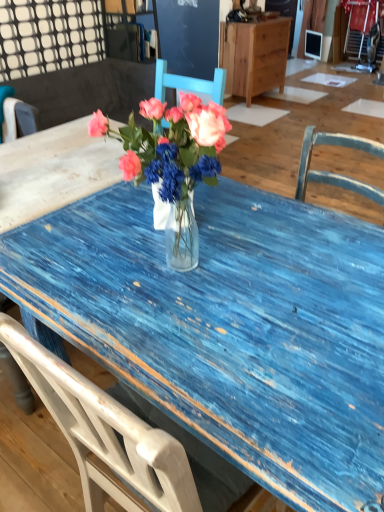
What do you see at coordinates (175, 146) in the screenshot?
I see `matte glass vase at center` at bounding box center [175, 146].

The height and width of the screenshot is (512, 384). I want to click on wooden cabinet at upper center, so click(254, 56).

This screenshot has height=512, width=384. Find the location of `white wood chair at left, which is the 2th chair from right to left`. white wood chair at left, which is the 2th chair from right to left is located at coordinates (18, 119).

This screenshot has width=384, height=512. Identify the location of matte glass vase at center. (175, 146).

Find the location of a particular element. The width and height of the screenshot is (384, 512). chair that is the 2nd one below the matte glass vase at center (from a real-world perspective) is located at coordinates (88, 91).

How different are the orientations of matte glass vase at center and blue wooden chair at upper left, acting as the first chair starting from the right, in degrees?

They differ by 131 degrees in their facing directions.

From the image's perspective, is matte glass vase at center beneath blue wooden chair at upper left, which is the second chair in left-to-right order?

Yes, from the image's perspective, matte glass vase at center is beneath blue wooden chair at upper left, which is the second chair in left-to-right order.

Consider the image. Between matte glass vase at center and blue wooden chair at upper left, acting as the first chair starting from the right, which one has more height?

blue wooden chair at upper left, acting as the first chair starting from the right, is taller.

Is wooden cabinet at upper center bigger than matte glass vase at center?

Correct, wooden cabinet at upper center is larger in size than matte glass vase at center.

What's the angular difference between wooden cabinet at upper center and matte glass vase at center's facing directions?

There is a 130-degree angle between the facing directions of wooden cabinet at upper center and matte glass vase at center.

From the image's perspective, which is above, wooden cabinet at upper center or matte glass vase at center?

From the image's view, wooden cabinet at upper center is above.

Which object is closer to the camera taking this photo, wooden cabinet at upper center or matte glass vase at center?

Positioned in front is matte glass vase at center.

Consider the image. Is white wood chair at left, which is the 2th chair from right to left, far away from matte glass vase at center?

white wood chair at left, which is the 2th chair from right to left, is far away from matte glass vase at center.

Is white wood chair at left, placed as the 1th chair when sorted from left to right, thinner than matte glass vase at center?

Indeed, white wood chair at left, placed as the 1th chair when sorted from left to right, has a lesser width compared to matte glass vase at center.

Between white wood chair at left, placed as the 1th chair when sorted from left to right, and matte glass vase at center, which one is positioned in front?

Positioned in front is matte glass vase at center.

In terms of height, does white wood chair at left, which is the 2th chair from right to left, look taller or shorter compared to matte glass vase at center?

Clearly, white wood chair at left, which is the 2th chair from right to left, is taller compared to matte glass vase at center.

Which is in front, blue wooden chair at upper left, which is the second chair in left-to-right order, or wooden cabinet at upper center?

blue wooden chair at upper left, which is the second chair in left-to-right order, is closer to the camera.

Based on the photo, how different are the orientations of blue wooden chair at upper left, acting as the first chair starting from the right, and wooden cabinet at upper center in degrees?

0.166 degrees separate the facing orientations of blue wooden chair at upper left, acting as the first chair starting from the right, and wooden cabinet at upper center.

Does blue wooden chair at upper left, acting as the first chair starting from the right, have a greater height compared to wooden cabinet at upper center?

No, blue wooden chair at upper left, acting as the first chair starting from the right, is not taller than wooden cabinet at upper center.

Is blue wooden chair at upper left, acting as the first chair starting from the right, positioned far away from wooden cabinet at upper center?

That's right, there is a large distance between blue wooden chair at upper left, acting as the first chair starting from the right, and wooden cabinet at upper center.

Can you confirm if matte glass vase at center is taller than white wood chair at left, placed as the 1th chair when sorted from left to right?

No.

From the picture: Is matte glass vase at center not near white wood chair at left, placed as the 1th chair when sorted from left to right?

That's right, there is a large distance between matte glass vase at center and white wood chair at left, placed as the 1th chair when sorted from left to right.

Does point (172, 167) come in front of point (30, 126)?

Yes, point (172, 167) is closer to viewer.

How different are the orientations of matte glass vase at center and white wood chair at left, which is the 2th chair from right to left, in degrees?

There is a 139-degree angle between the facing directions of matte glass vase at center and white wood chair at left, which is the 2th chair from right to left.

Where is `chair on the left of blue wooden chair at upper left, which is the second chair in left-to-right order`? This screenshot has width=384, height=512. chair on the left of blue wooden chair at upper left, which is the second chair in left-to-right order is located at coordinates (18, 119).

Does white wood chair at left, which is the 2th chair from right to left, have a larger size compared to blue wooden chair at upper left, acting as the first chair starting from the right?

No.

From the picture: Which object is positioned more to the right, white wood chair at left, which is the 2th chair from right to left, or blue wooden chair at upper left, acting as the first chair starting from the right?

blue wooden chair at upper left, acting as the first chair starting from the right, is more to the right.

What's the angular difference between white wood chair at left, placed as the 1th chair when sorted from left to right, and blue wooden chair at upper left, acting as the first chair starting from the right,'s facing directions?

white wood chair at left, placed as the 1th chair when sorted from left to right, and blue wooden chair at upper left, acting as the first chair starting from the right, are facing 90.5 degrees away from each other.

Is blue wooden chair at upper left, acting as the first chair starting from the right, oriented away from white wood chair at left, placed as the 1th chair when sorted from left to right?

No.

Does blue wooden chair at upper left, acting as the first chair starting from the right, come in front of white wood chair at left, placed as the 1th chair when sorted from left to right?

Yes, blue wooden chair at upper left, acting as the first chair starting from the right, is closer to the viewer.

From a real-world perspective, between blue wooden chair at upper left, acting as the first chair starting from the right, and white wood chair at left, placed as the 1th chair when sorted from left to right, who is vertically higher?

white wood chair at left, placed as the 1th chair when sorted from left to right, from a real-world perspective.

The width and height of the screenshot is (384, 512). Identify the location of chair in front of the white wood chair at left, placed as the 1th chair when sorted from left to right. (88, 91).

Identify the location of flower positioned vertically above the blue wooden chair at upper left, acting as the first chair starting from the right (from a real-world perspective). (175, 146).

This screenshot has width=384, height=512. What are the coordinates of `cabinetry on the right of matte glass vase at center` in the screenshot? It's located at (254, 56).

Based on their spatial positions, is white wood chair at left, which is the 2th chair from right to left, or matte glass vase at center further from blue wooden chair at upper left, which is the second chair in left-to-right order?

matte glass vase at center.

Which object lies further to the anchor point matte glass vase at center, blue wooden chair at upper left, acting as the first chair starting from the right, or wooden cabinet at upper center?

wooden cabinet at upper center lies further to matte glass vase at center than the other object.

Which object lies further to the anchor point wooden cabinet at upper center, matte glass vase at center or white wood chair at left, which is the 2th chair from right to left?

matte glass vase at center is further to wooden cabinet at upper center.

Estimate the real-world distances between objects in this image. Which object is closer to blue wooden chair at upper left, which is the second chair in left-to-right order, white wood chair at left, placed as the 1th chair when sorted from left to right, or wooden cabinet at upper center?

The object closer to blue wooden chair at upper left, which is the second chair in left-to-right order, is white wood chair at left, placed as the 1th chair when sorted from left to right.

Estimate the real-world distances between objects in this image. Which object is further from matte glass vase at center, wooden cabinet at upper center or blue wooden chair at upper left, acting as the first chair starting from the right?

wooden cabinet at upper center lies further to matte glass vase at center than the other object.

Based on the photo, estimate the real-world distances between objects in this image. Which object is closer to white wood chair at left, placed as the 1th chair when sorted from left to right, wooden cabinet at upper center or matte glass vase at center?

The object closer to white wood chair at left, placed as the 1th chair when sorted from left to right, is matte glass vase at center.

Looking at the image, which one is located closer to wooden cabinet at upper center, white wood chair at left, placed as the 1th chair when sorted from left to right, or matte glass vase at center?

white wood chair at left, placed as the 1th chair when sorted from left to right, is closer to wooden cabinet at upper center.

Estimate the real-world distances between objects in this image. Which object is further from white wood chair at left, placed as the 1th chair when sorted from left to right, matte glass vase at center or wooden cabinet at upper center?

The object further to white wood chair at left, placed as the 1th chair when sorted from left to right, is wooden cabinet at upper center.

Locate an element on the screen. chair located between blue wooden chair at upper left, acting as the first chair starting from the right, and wooden cabinet at upper center in the depth direction is located at coordinates (18, 119).

Locate an element on the screen. This screenshot has width=384, height=512. chair between matte glass vase at center and white wood chair at left, which is the 2th chair from right to left, in the front-back direction is located at coordinates (88, 91).